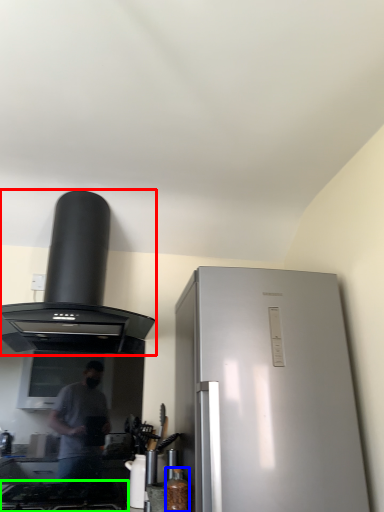
Question: Which is nearer to the kitchen appliance (highlighted by a red box)? bottle (highlighted by a blue box) or gas stove (highlighted by a green box).

Choices:
 (A) bottle
 (B) gas stove

Answer: (B)